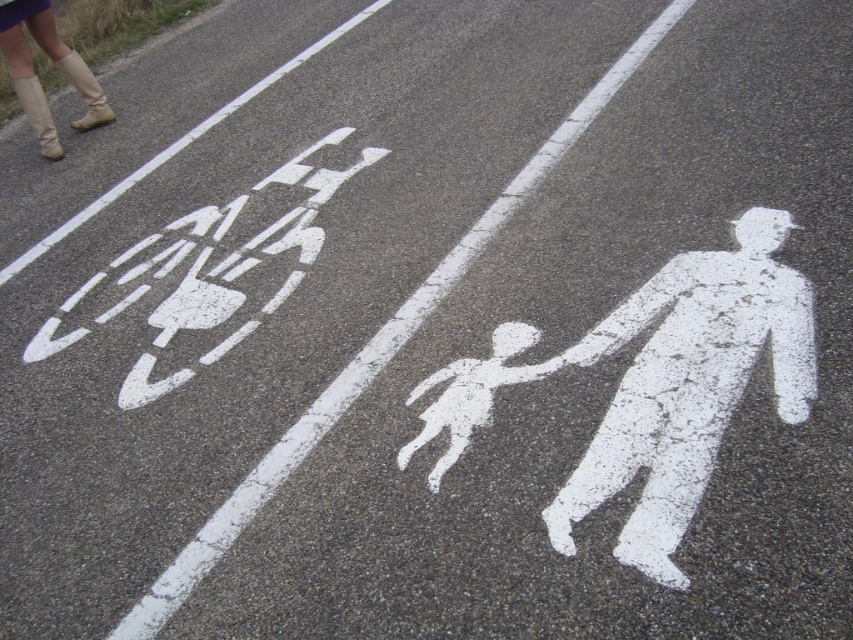
Question: Which of the following is the farthest from the observer?

Choices:
 (A) (405, 449)
 (B) (573, 490)
 (C) (65, 49)

Answer: (C)

Question: Does white chalk figure at center lie behind beige leather boots at upper left?

Choices:
 (A) no
 (B) yes

Answer: (A)

Question: Does white matte pedestrian at center appear under beige leather boots at upper left?

Choices:
 (A) yes
 (B) no

Answer: (A)

Question: Can you confirm if white chalk figure at center is positioned above beige leather boots at upper left?

Choices:
 (A) yes
 (B) no

Answer: (B)

Question: Which object is positioned closest to the white chalk figure at center?

Choices:
 (A) white matte pedestrian at center
 (B) beige leather boots at upper left

Answer: (A)

Question: Which object is farther from the camera taking this photo?

Choices:
 (A) white chalk figure at center
 (B) beige leather boots at upper left
 (C) white matte pedestrian at center

Answer: (B)